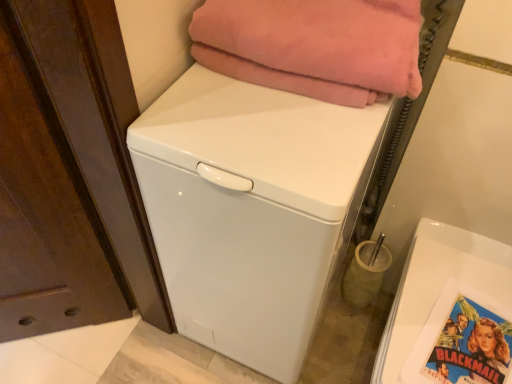
Identify the location of blank space situated above white glossy washing machine at center (from a real-world perspective). (269, 115).